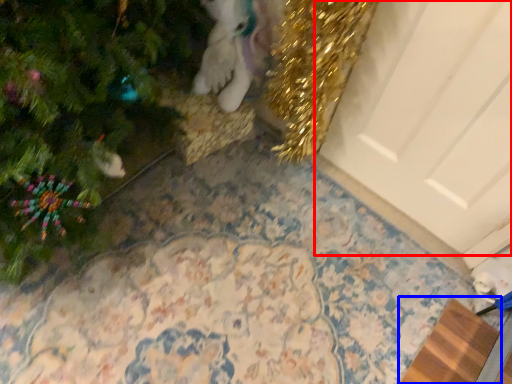
Question: Which object appears farthest to the camera in this image, door (highlighted by a red box) or doormat (highlighted by a blue box)?

Choices:
 (A) door
 (B) doormat

Answer: (B)